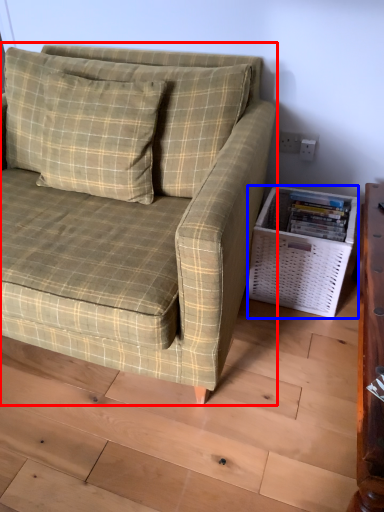
Question: Which point is closer to the camera, studio couch (highlighted by a red box) or basket (highlighted by a blue box)?

Choices:
 (A) studio couch
 (B) basket

Answer: (A)